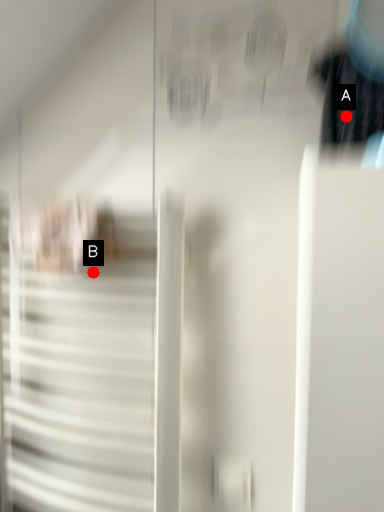
Question: Two points are circled on the image, labeled by A and B beside each circle. Which point is farther to the camera?

Choices:
 (A) A is further
 (B) B is further

Answer: (B)